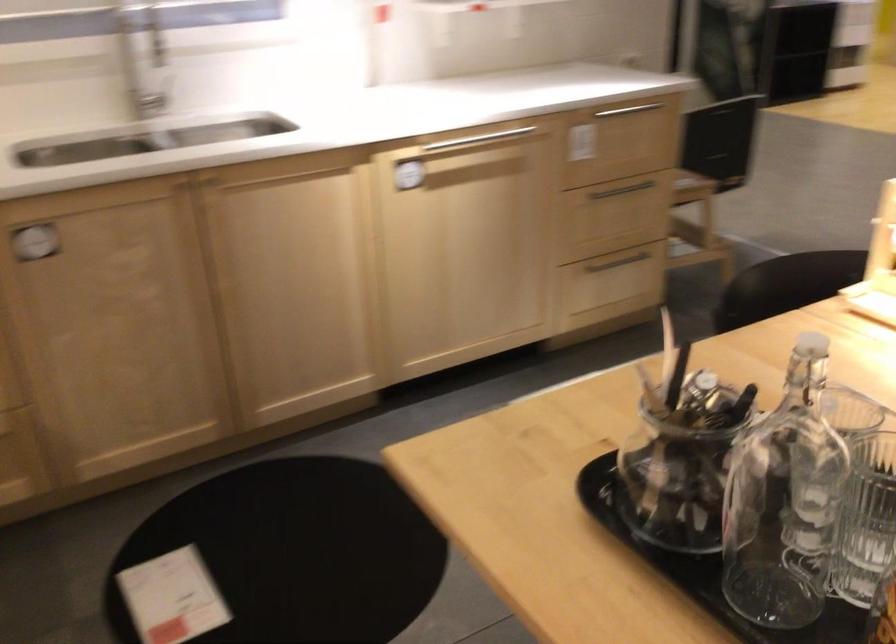
The image size is (896, 644). In order to click on swing-top glass bottle in this screenshot , I will do `click(785, 500)`.